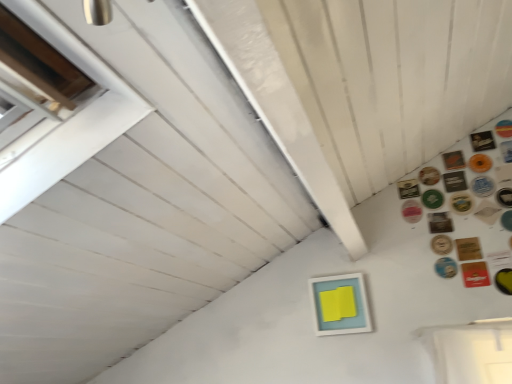
Question: Is green rubber button at upper right, which ranks as the 8th button in bottom-to-top order, positioned in front of wooden button at upper right, the 4th button ordered from the bottom?

Choices:
 (A) yes
 (B) no

Answer: (B)

Question: Considering the relative sizes of green rubber button at upper right, which is counted as the tenth button, starting from the top, and wooden button at upper right, arranged as the 14th button when viewed from the top, in the image provided, is green rubber button at upper right, which is counted as the tenth button, starting from the top, thinner than wooden button at upper right, arranged as the 14th button when viewed from the top,?

Choices:
 (A) no
 (B) yes

Answer: (A)

Question: Considering the relative sizes of green rubber button at upper right, which is counted as the tenth button, starting from the top, and wooden button at upper right, the 4th button ordered from the bottom, in the image provided, is green rubber button at upper right, which is counted as the tenth button, starting from the top, taller than wooden button at upper right, the 4th button ordered from the bottom,?

Choices:
 (A) yes
 (B) no

Answer: (A)

Question: Does green rubber button at upper right, which is counted as the tenth button, starting from the top, turn towards wooden button at upper right, the 4th button ordered from the bottom?

Choices:
 (A) no
 (B) yes

Answer: (A)

Question: Is green rubber button at upper right, which ranks as the 8th button in bottom-to-top order, positioned with its back to wooden button at upper right, arranged as the 14th button when viewed from the top?

Choices:
 (A) no
 (B) yes

Answer: (A)

Question: Is green rubber button at upper right, which is counted as the tenth button, starting from the top, further to camera compared to wooden button at upper right, the 4th button ordered from the bottom?

Choices:
 (A) yes
 (B) no

Answer: (A)

Question: Is green rubber button at upper right, which ranks as the 8th button in bottom-to-top order, bigger than pink glossy button at upper right, which is the 7th button from bottom to top?

Choices:
 (A) no
 (B) yes

Answer: (B)

Question: Is green rubber button at upper right, which ranks as the 8th button in bottom-to-top order, further to the viewer compared to pink glossy button at upper right, which is the 7th button from bottom to top?

Choices:
 (A) no
 (B) yes

Answer: (A)

Question: Does green rubber button at upper right, which is counted as the tenth button, starting from the top, have a greater height compared to pink glossy button at upper right, which is the 7th button from bottom to top?

Choices:
 (A) no
 (B) yes

Answer: (B)

Question: Would you say pink glossy button at upper right, which is the 7th button from bottom to top, is part of green rubber button at upper right, which is counted as the tenth button, starting from the top,'s contents?

Choices:
 (A) no
 (B) yes

Answer: (A)

Question: From the image's perspective, is green rubber button at upper right, which ranks as the 8th button in bottom-to-top order, on top of pink glossy button at upper right, which is the 7th button from bottom to top?

Choices:
 (A) no
 (B) yes

Answer: (B)

Question: From a real-world perspective, is green rubber button at upper right, which ranks as the 8th button in bottom-to-top order, positioned under pink glossy button at upper right, arranged as the 11th button when viewed from the top, based on gravity?

Choices:
 (A) no
 (B) yes

Answer: (B)

Question: Is the depth of brown leather coaster at upper right, acting as the fifth button starting from the top, greater than that of light blue matte picture frame at center?

Choices:
 (A) yes
 (B) no

Answer: (A)